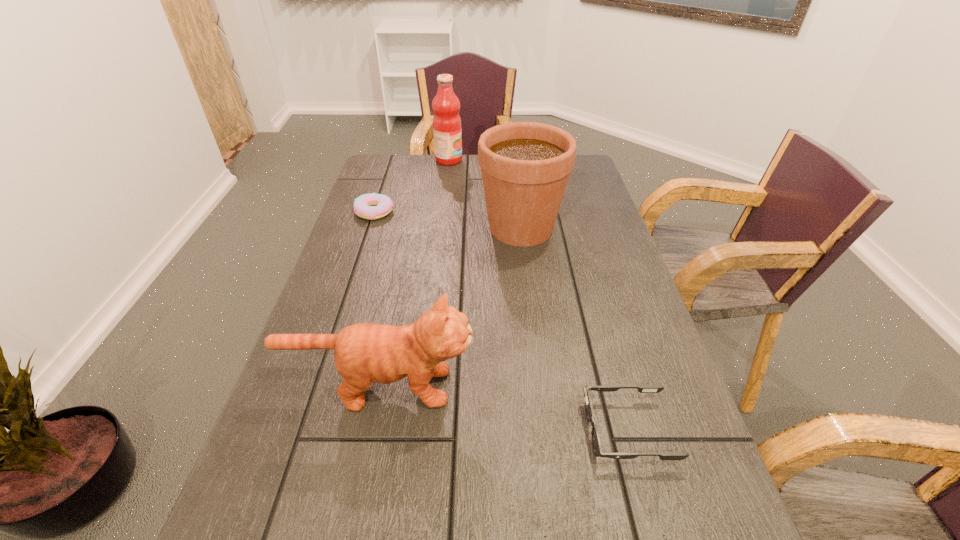
Find the location of a particular element. This screenshot has width=960, height=540. vacant space located 0.310m on the temples of the sunglasses is located at coordinates (412, 430).

Find the location of a particular element. Image resolution: width=960 pixels, height=540 pixels. vacant space located on the temples of the sunglasses is located at coordinates (429, 430).

Image resolution: width=960 pixels, height=540 pixels. What are the coordinates of `object at the far edge` in the screenshot? It's located at (447, 131).

The width and height of the screenshot is (960, 540). In order to click on cat that is positioned at the left edge in this screenshot , I will do `click(364, 352)`.

Image resolution: width=960 pixels, height=540 pixels. Identify the location of doughnut at the left edge. (370, 206).

Image resolution: width=960 pixels, height=540 pixels. Find the location of `flowerpot that is at the right edge`. flowerpot that is at the right edge is located at coordinates (525, 166).

Where is `sunglasses present at the right edge`? The image size is (960, 540). sunglasses present at the right edge is located at coordinates (596, 443).

The width and height of the screenshot is (960, 540). What are the coordinates of `vacant space at the left edge` in the screenshot? It's located at (331, 267).

Locate an element on the screen. The width and height of the screenshot is (960, 540). free region at the right edge is located at coordinates (609, 224).

Locate an element on the screen. The width and height of the screenshot is (960, 540). vacant region at the far right corner of the desktop is located at coordinates (581, 174).